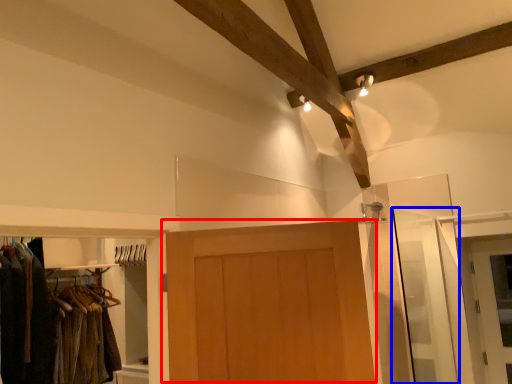
Question: Which of the following is the closest to the observer, door (highlighted by a red box) or screen door (highlighted by a blue box)?

Choices:
 (A) door
 (B) screen door

Answer: (A)